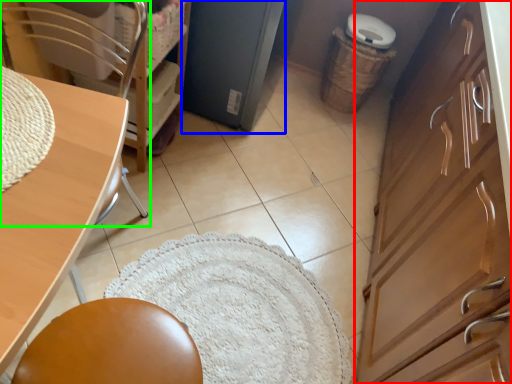
Question: Considering the real-world distances, which object is farthest from cabinetry (highlighted by a red box)? screen door (highlighted by a blue box) or chair (highlighted by a green box)?

Choices:
 (A) screen door
 (B) chair

Answer: (B)